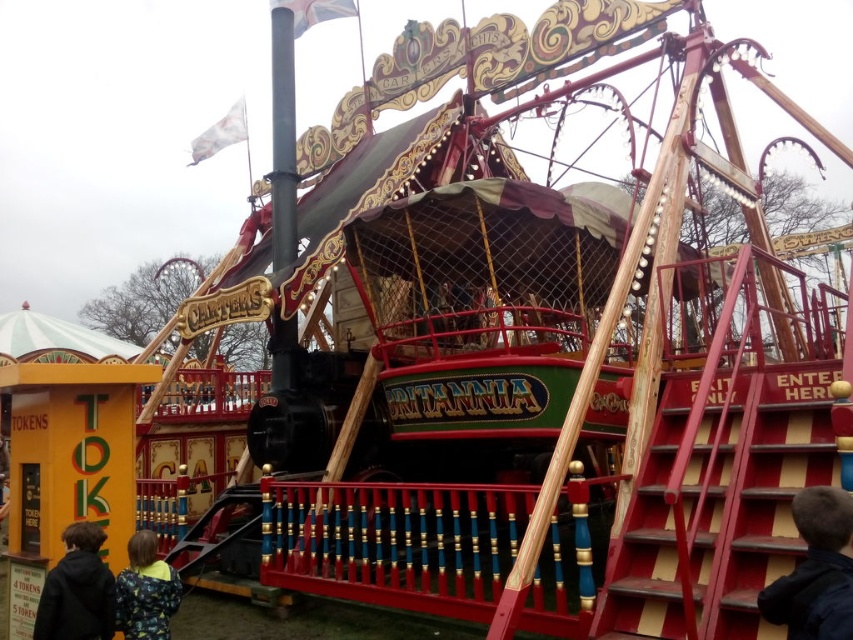
You are a photographer at the fairground and want to capture both the dark blue jacket at lower left and the camouflage jacket at lower left in a single shot. Given their sizes, which jacket will appear smaller in the photo?

The dark blue jacket at lower left occupies less space than the camouflage jacket at lower left, so it will appear smaller in the photo.

You are a photographer standing in front of the Britannia carousel. You notice two jackets hanging on the decorative railing at the lower part of the carousel. The jackets are the dark blue jacket at lower right and the camouflage jacket at lower left. Which jacket is wider?

The dark blue jacket at lower right is wider than the camouflage jacket at lower left according to the description.

You are a maintenance worker needing to inspect both dark blue jackets at lower right and dark blue jacket at lower left. The maintenance cart you drive can travel 5 meters before needing a recharge. Do you need to recharge before starting your inspection if you begin at the dark blue jacket at lower right?

The distance between the dark blue jacket at lower right and dark blue jacket at lower left is 6.25 meters. Since the maintenance cart can only travel 5 meters before needing a recharge, you will need to recharge before starting the inspection to ensure you can reach both jackets without running out of power.